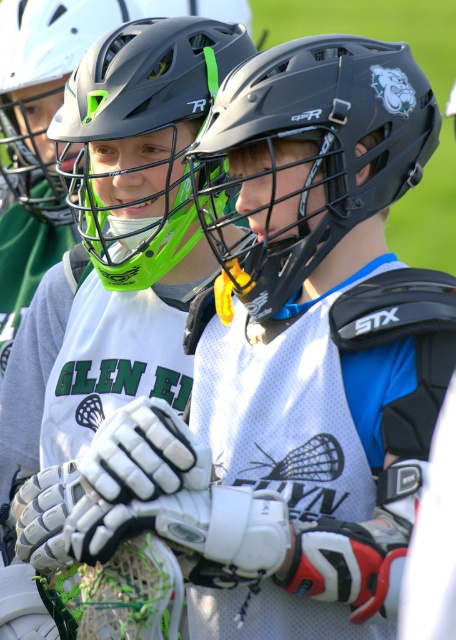
You are a sports photographer trying to capture a photo of both lacrosse players. You notice the black matte helmet at center and the matte black helmet at upper center. Which helmet is positioned to the right side of the other?

The black matte helmet at center is to the right of the matte black helmet at upper center.

Consider the image. You are a photographer standing at the center of the field. You want to take a photo of both players. Which point, point (x=193, y=218) or point (x=92, y=60), is closer to your camera?

Point (x=92, y=60) is closer to the camera because it is less further to the camera than point (x=193, y=218).